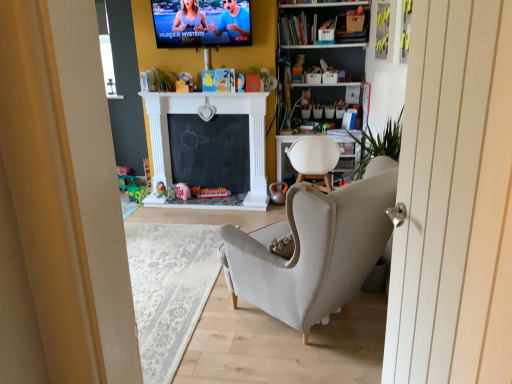
What do you see at coordinates (133, 187) in the screenshot?
I see `green plastic toy at lower left, which is counted as the 5th toy, starting from the right` at bounding box center [133, 187].

Where is `pink fabric toy at center, arranged as the 3th toy when viewed from the right`? pink fabric toy at center, arranged as the 3th toy when viewed from the right is located at coordinates (182, 191).

The image size is (512, 384). What do you see at coordinates (161, 189) in the screenshot?
I see `translucent plastic toy at center, which is counted as the 2th toy, starting from the left` at bounding box center [161, 189].

Where is `matte pink piggy bank at center, the second toy in the right-to-left sequence`? The width and height of the screenshot is (512, 384). matte pink piggy bank at center, the second toy in the right-to-left sequence is located at coordinates (213, 193).

Find the location of a particular element. The width and height of the screenshot is (512, 384). green plastic toy at lower left, which is counted as the 5th toy, starting from the right is located at coordinates (133, 187).

Is matte plastic tv at upper center oriented away from matte pink piggy bank at center, the fourth toy viewed from the left?

matte plastic tv at upper center is not turned away from matte pink piggy bank at center, the fourth toy viewed from the left.

Which is further, (x=219, y=27) or (x=209, y=194)?

The point (x=209, y=194) is farther from the camera.

Consider the image. Based on their positions, is matte plastic tv at upper center located to the left or right of matte pink piggy bank at center, the fourth toy viewed from the left?

In the image, matte plastic tv at upper center appears on the left side of matte pink piggy bank at center, the fourth toy viewed from the left.

In the scene shown: Does matte plastic tv at upper center touch matte pink piggy bank at center, the fourth toy viewed from the left?

matte plastic tv at upper center and matte pink piggy bank at center, the fourth toy viewed from the left, are clearly separated.

Which object is closer to the camera, matte plastic tv at upper center or metallic silver toy at center, placed as the fifth toy when sorted from left to right?

matte plastic tv at upper center is closer to the camera.

Considering the relative sizes of matte plastic tv at upper center and metallic silver toy at center, placed as the fifth toy when sorted from left to right, in the image provided, is matte plastic tv at upper center bigger than metallic silver toy at center, placed as the fifth toy when sorted from left to right,?

Yes, matte plastic tv at upper center is bigger than metallic silver toy at center, placed as the fifth toy when sorted from left to right.

Between matte plastic tv at upper center and metallic silver toy at center, placed as the fifth toy when sorted from left to right, which one has less height?

Standing shorter between the two is metallic silver toy at center, placed as the fifth toy when sorted from left to right.

Who is taller, matte pink piggy bank at center, the fourth toy viewed from the left, or white fabric chair at center?

Standing taller between the two is white fabric chair at center.

Does matte pink piggy bank at center, the fourth toy viewed from the left, have a lesser width compared to white fabric chair at center?

Correct, the width of matte pink piggy bank at center, the fourth toy viewed from the left, is less than that of white fabric chair at center.

Is matte pink piggy bank at center, the second toy in the right-to-left sequence, positioned beyond the bounds of white fabric chair at center?

Absolutely, matte pink piggy bank at center, the second toy in the right-to-left sequence, is external to white fabric chair at center.

Between matte pink piggy bank at center, the fourth toy viewed from the left, and white fabric chair at center, which one appears on the left side from the viewer's perspective?

matte pink piggy bank at center, the fourth toy viewed from the left.

Is matte pink piggy bank at center, the fourth toy viewed from the left, positioned far away from translucent plastic toy at center, the 4th toy positioned from the right?

No, matte pink piggy bank at center, the fourth toy viewed from the left, is in close proximity to translucent plastic toy at center, the 4th toy positioned from the right.

Which is in front, point (213, 195) or point (159, 184)?

Point (213, 195)

The height and width of the screenshot is (384, 512). What are the coordinates of `toy that is the 1st object located in front of the translucent plastic toy at center, the 4th toy positioned from the right` in the screenshot? It's located at (213, 193).

From the image's perspective, who appears lower, matte pink piggy bank at center, the second toy in the right-to-left sequence, or translucent plastic toy at center, which is counted as the 2th toy, starting from the left?

matte pink piggy bank at center, the second toy in the right-to-left sequence, is shown below in the image.

In terms of size, does matte pink piggy bank at center, the fourth toy viewed from the left, appear bigger or smaller than matte plastic tv at upper center?

In the image, matte pink piggy bank at center, the fourth toy viewed from the left, appears to be smaller than matte plastic tv at upper center.

How distant is matte pink piggy bank at center, the fourth toy viewed from the left, from matte plastic tv at upper center?

The distance of matte pink piggy bank at center, the fourth toy viewed from the left, from matte plastic tv at upper center is 5.69 feet.

Which is behind, matte pink piggy bank at center, the fourth toy viewed from the left, or matte plastic tv at upper center?

matte pink piggy bank at center, the fourth toy viewed from the left, is more distant.

From a real-world perspective, is pink fabric toy at center, the 3th toy from the left, positioned over green plastic toy at lower left, marked as the 1th toy in a left-to-right arrangement, based on gravity?

Yes, from a real-world perspective, pink fabric toy at center, the 3th toy from the left, is over green plastic toy at lower left, marked as the 1th toy in a left-to-right arrangement

Between pink fabric toy at center, arranged as the 3th toy when viewed from the right, and green plastic toy at lower left, which is counted as the 5th toy, starting from the right, which one has more height?

pink fabric toy at center, arranged as the 3th toy when viewed from the right, is taller.

Are pink fabric toy at center, the 3th toy from the left, and green plastic toy at lower left, which is counted as the 5th toy, starting from the right, far apart?

No, there isn't a large distance between pink fabric toy at center, the 3th toy from the left, and green plastic toy at lower left, which is counted as the 5th toy, starting from the right.

Is point (184, 195) closer to viewer compared to point (140, 191)?

That is True.

From the image's perspective, is pink fabric toy at center, the 3th toy from the left, above translucent plastic toy at center, the 4th toy positioned from the right?

Actually, pink fabric toy at center, the 3th toy from the left, appears below translucent plastic toy at center, the 4th toy positioned from the right, in the image.

From the picture: Considering the relative sizes of pink fabric toy at center, arranged as the 3th toy when viewed from the right, and translucent plastic toy at center, the 4th toy positioned from the right, in the image provided, is pink fabric toy at center, arranged as the 3th toy when viewed from the right, wider than translucent plastic toy at center, the 4th toy positioned from the right,?

In fact, pink fabric toy at center, arranged as the 3th toy when viewed from the right, might be narrower than translucent plastic toy at center, the 4th toy positioned from the right.

Is pink fabric toy at center, the 3th toy from the left, not inside translucent plastic toy at center, which is counted as the 2th toy, starting from the left?

Yes, pink fabric toy at center, the 3th toy from the left, is not within translucent plastic toy at center, which is counted as the 2th toy, starting from the left.

This screenshot has height=384, width=512. What are the coordinates of `tv show in front of the matte pink piggy bank at center, the second toy in the right-to-left sequence` in the screenshot? It's located at pos(201,23).

Image resolution: width=512 pixels, height=384 pixels. Identify the location of tv show to the left of metallic silver toy at center, placed as the fifth toy when sorted from left to right. (201, 23).

Looking at the image, which one is located closer to matte plastic tv at upper center, white fabric chair at center or translucent plastic toy at center, the 4th toy positioned from the right?

white fabric chair at center is positioned closer to the anchor matte plastic tv at upper center.

Considering their positions, is green plastic toy at lower left, marked as the 1th toy in a left-to-right arrangement, positioned closer to pink fabric toy at center, the 3th toy from the left, than matte pink piggy bank at center, the fourth toy viewed from the left?

The object closer to pink fabric toy at center, the 3th toy from the left, is matte pink piggy bank at center, the fourth toy viewed from the left.

When comparing their distances from white fabric chair at center, does metallic silver toy at center, placed as the fifth toy when sorted from left to right, or green plastic toy at lower left, which is counted as the 5th toy, starting from the right, seem further?

green plastic toy at lower left, which is counted as the 5th toy, starting from the right, is further to white fabric chair at center.

From the image, which object appears to be nearer to white fabric chair at center, matte plastic tv at upper center or matte pink piggy bank at center, the fourth toy viewed from the left?

The object closer to white fabric chair at center is matte pink piggy bank at center, the fourth toy viewed from the left.

When comparing their distances from matte pink piggy bank at center, the second toy in the right-to-left sequence, does white fabric chair at center or metallic silver toy at center, which is counted as the 1th toy, starting from the right, seem further?

white fabric chair at center.

Which object lies further to the anchor point matte pink piggy bank at center, the fourth toy viewed from the left, pink fabric toy at center, arranged as the 3th toy when viewed from the right, or white fabric chair at center?

Among the two, white fabric chair at center is located further to matte pink piggy bank at center, the fourth toy viewed from the left.

Estimate the real-world distances between objects in this image. Which object is further from white fabric chair at center, green plastic toy at lower left, marked as the 1th toy in a left-to-right arrangement, or translucent plastic toy at center, which is counted as the 2th toy, starting from the left?

green plastic toy at lower left, marked as the 1th toy in a left-to-right arrangement, is further to white fabric chair at center.

Estimate the real-world distances between objects in this image. Which object is closer to white fabric chair at center, matte plastic tv at upper center or pink fabric toy at center, the 3th toy from the left?

pink fabric toy at center, the 3th toy from the left, is closer to white fabric chair at center.

The width and height of the screenshot is (512, 384). Identify the location of chair between matte plastic tv at upper center and translucent plastic toy at center, the 4th toy positioned from the right, in the vertical direction. (314, 159).

Locate an element on the screen. The image size is (512, 384). toy between matte pink piggy bank at center, the second toy in the right-to-left sequence, and white fabric chair at center is located at coordinates (278, 192).

The width and height of the screenshot is (512, 384). I want to click on toy between translucent plastic toy at center, the 4th toy positioned from the right, and matte pink piggy bank at center, the second toy in the right-to-left sequence, from left to right, so click(182, 191).

Find the location of `toy between green plastic toy at lower left, marked as the 1th toy in a left-to-right arrangement, and pink fabric toy at center, the 3th toy from the left, from left to right`. toy between green plastic toy at lower left, marked as the 1th toy in a left-to-right arrangement, and pink fabric toy at center, the 3th toy from the left, from left to right is located at coordinates (x=161, y=189).